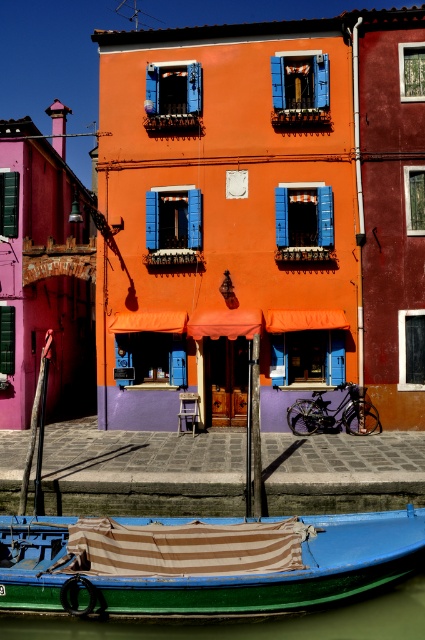
You are standing on the dock near the green painted wood boat at lower center and want to board the boat. Is the green smooth water at lower left visible from your current position?

The green painted wood boat at lower center is taller than the green smooth water at lower left, so yes, the green smooth water at lower left is visible from your current position on the dock.

You are standing at the canal side and want to take a photo of the green painted wood boat at lower center. If your camera can focus on objects up to 10 meters away, will you be able to capture a clear image of the boat?

The green painted wood boat at lower center is 9.89 meters away from the camera, which is within the camera focus range of up to 10 meters. Therefore, you can capture a clear image of the boat.

You are a tourist standing on the canal bank and want to take a photo of the green painted wood boat at lower center and the green smooth water at lower left. Which object should you focus on first if you want to capture both in a single frame without moving the camera?

You should focus on the green painted wood boat at lower center first because it is positioned to the left of the green smooth water at lower left, so capturing it first ensures both are within the frame.